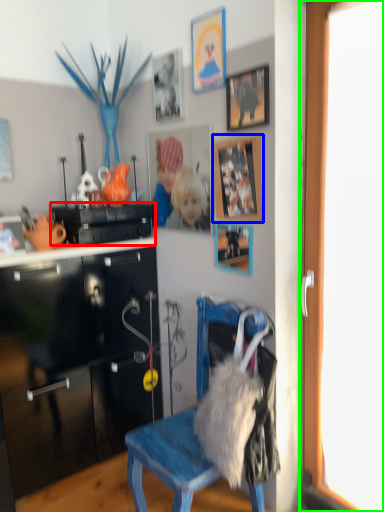
Question: Estimate the real-world distances between objects in this image. Which object is farther from cabinetry (highlighted by a red box), picture frame (highlighted by a blue box) or screen door (highlighted by a green box)?

Choices:
 (A) picture frame
 (B) screen door

Answer: (B)